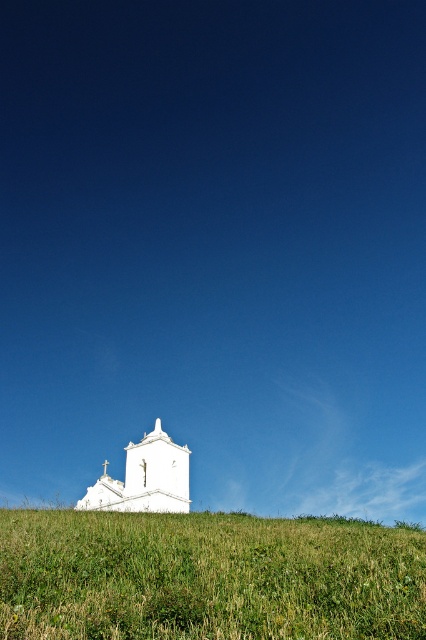
Question: Which point is farther to the camera?

Choices:
 (A) (89, 492)
 (B) (236, 634)

Answer: (A)

Question: Which of the following is the farthest from the observer?

Choices:
 (A) (356, 564)
 (B) (157, 460)

Answer: (B)

Question: Which of the following is the farthest from the observer?

Choices:
 (A) white smooth church at lower center
 (B) green grassy hillside at lower center

Answer: (A)

Question: Is green grassy hillside at lower center bigger than white smooth church at lower center?

Choices:
 (A) yes
 (B) no

Answer: (A)

Question: Does green grassy hillside at lower center appear under white smooth church at lower center?

Choices:
 (A) yes
 (B) no

Answer: (B)

Question: From the image, what is the correct spatial relationship of green grassy hillside at lower center in relation to white smooth church at lower center?

Choices:
 (A) above
 (B) below

Answer: (A)